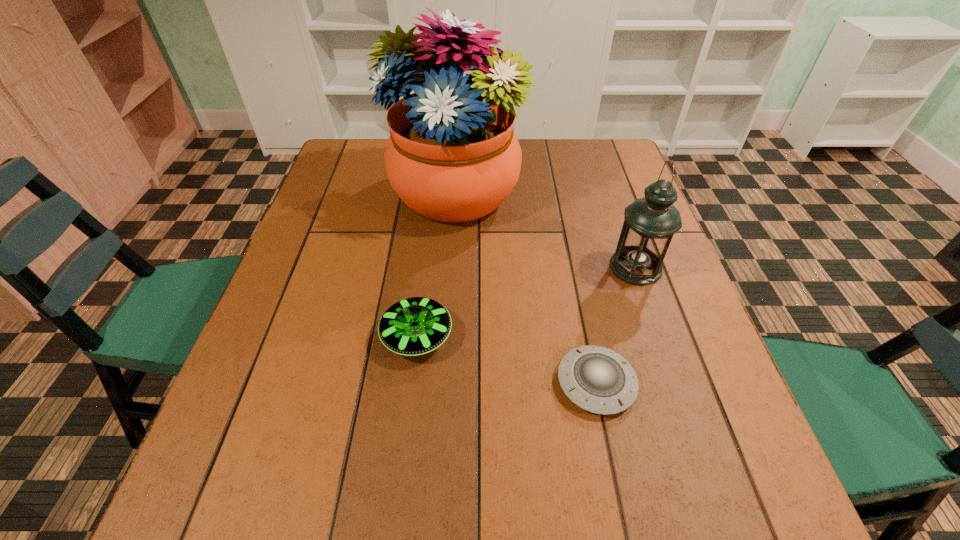
This screenshot has height=540, width=960. I want to click on empty location between the oil lamp and the second object from right to left, so [616, 325].

Where is `object that is the closest to the farthest object`? Image resolution: width=960 pixels, height=540 pixels. object that is the closest to the farthest object is located at coordinates (650, 222).

Locate an element on the screen. This screenshot has height=540, width=960. object that stands as the second closest to the shorter saucer is located at coordinates (414, 326).

Find the location of `vacant space that satisfies the following two spatial constraints: 1. on the front side of the oil lamp; 2. on the right side of the flower arrangement`. vacant space that satisfies the following two spatial constraints: 1. on the front side of the oil lamp; 2. on the right side of the flower arrangement is located at coordinates (450, 267).

Locate an element on the screen. The width and height of the screenshot is (960, 540). vacant space that satisfies the following two spatial constraints: 1. on the back side of the second shortest object; 2. on the left side of the rightmost object is located at coordinates (425, 267).